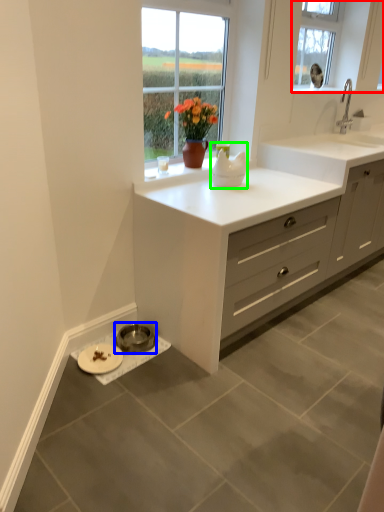
Question: Which object is positioned closest to window (highlighted by a red box)? Select from appliance (highlighted by a blue box) and appliance (highlighted by a green box).

Choices:
 (A) appliance
 (B) appliance

Answer: (B)